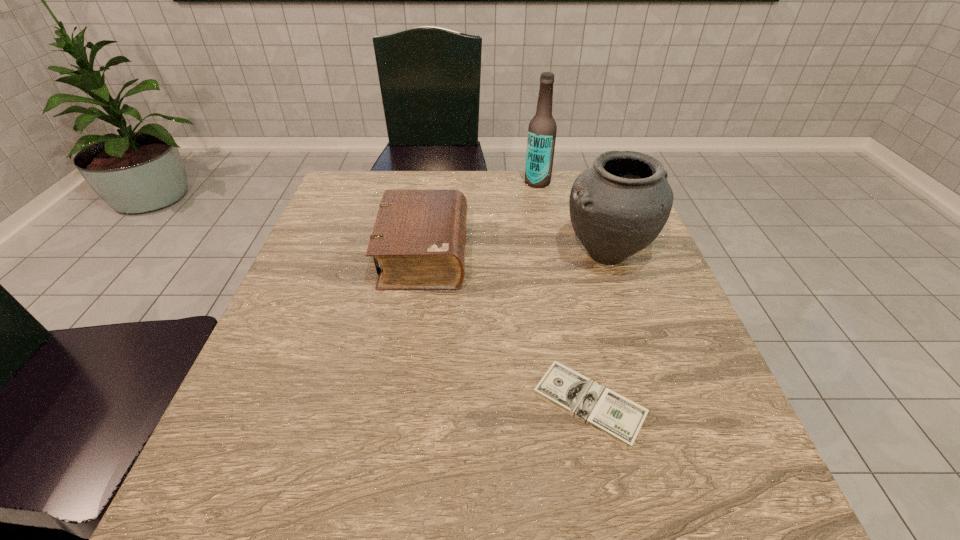
Find the location of `vacant space that satisfies the following two spatial constraints: 1. on the label of the tallest object; 2. on the back side of the shortest object`. vacant space that satisfies the following two spatial constraints: 1. on the label of the tallest object; 2. on the back side of the shortest object is located at coordinates (580, 404).

Where is `blank space that satisfies the following two spatial constraints: 1. on the spine side of the shortest object; 2. on the right side of the leftmost object`? The image size is (960, 540). blank space that satisfies the following two spatial constraints: 1. on the spine side of the shortest object; 2. on the right side of the leftmost object is located at coordinates (402, 404).